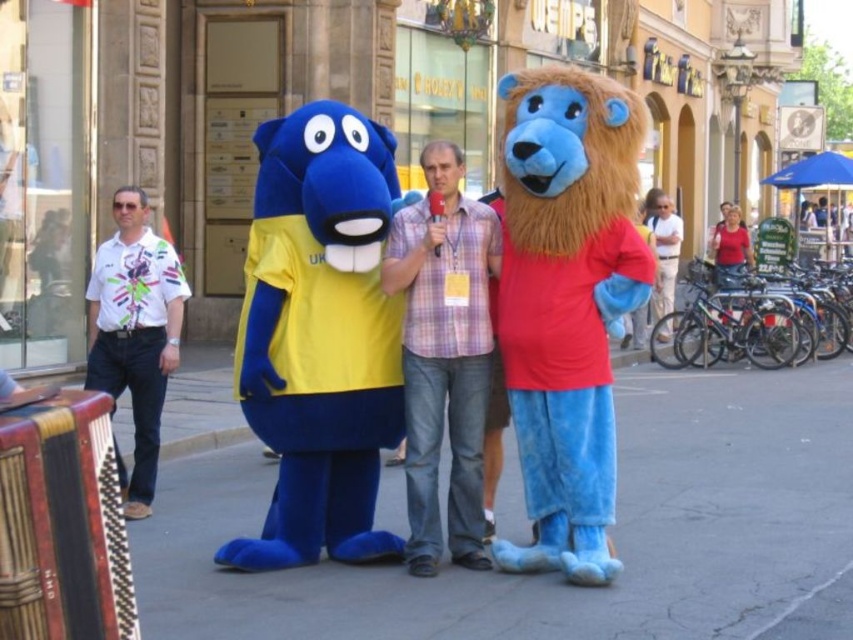
Between blue plush at center and blue plush bear at center, which one has less height?

With less height is blue plush at center.

Is blue plush at center smaller than blue plush bear at center?

Actually, blue plush at center might be larger than blue plush bear at center.

Find the location of a particular element. This screenshot has height=640, width=853. blue plush at center is located at coordinates (560, 577).

Where is `blue plush bear at center`? This screenshot has height=640, width=853. blue plush bear at center is located at coordinates (320, 336).

Is blue plush bear at center to the left of white printed shirt at left from the viewer's perspective?

In fact, blue plush bear at center is to the right of white printed shirt at left.

The height and width of the screenshot is (640, 853). Identify the location of blue plush bear at center. (320, 336).

The width and height of the screenshot is (853, 640). In order to click on blue plush bear at center in this screenshot , I will do pos(320,336).

Can you confirm if fuzzy blue lion at center is smaller than white printed shirt at left?

Actually, fuzzy blue lion at center might be larger than white printed shirt at left.

Does point (531, 243) come in front of point (154, 248)?

Yes, it is.

You are a GUI agent. You are given a task and a screenshot of the screen. Output one action in this format:
    pyautogui.click(x=<x>, y=<y>)
    Task: Click on the fuzzy blue lion at center
    This screenshot has height=640, width=853.
    Given the screenshot: What is the action you would take?
    pyautogui.click(x=567, y=304)